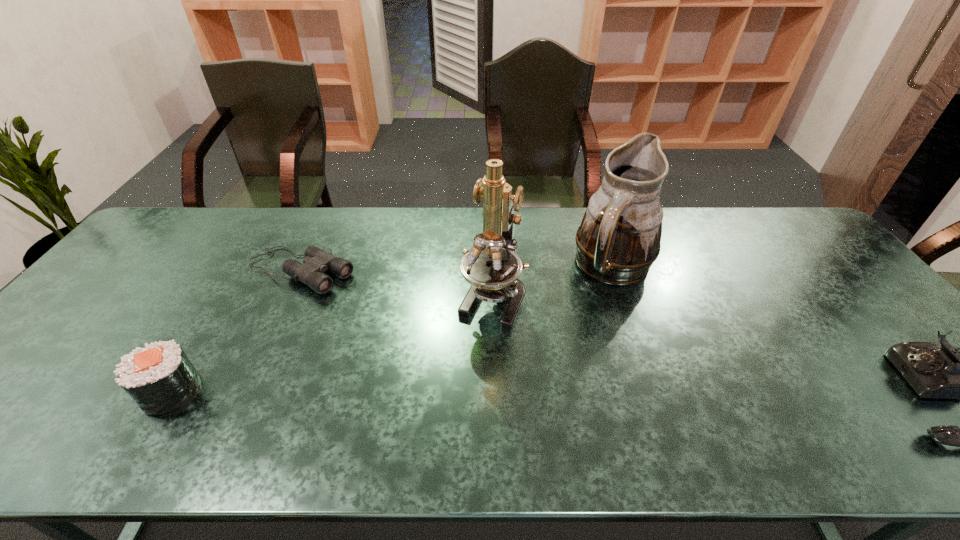
Where is `free space on the desktop that is between the sushi and the rightmost object and is positioned at the eyepiece of the shortest object`? Image resolution: width=960 pixels, height=540 pixels. free space on the desktop that is between the sushi and the rightmost object and is positioned at the eyepiece of the shortest object is located at coordinates (528, 393).

Identify the location of free space on the desktop that is between the sushi and the telephone and is positioned from the spout of the second tallest object. The image size is (960, 540). click(678, 394).

Where is `free space on the desktop that is between the sushi and the rightmost object and is positioned at the eyepiece of the microscope`? The height and width of the screenshot is (540, 960). free space on the desktop that is between the sushi and the rightmost object and is positioned at the eyepiece of the microscope is located at coordinates (444, 393).